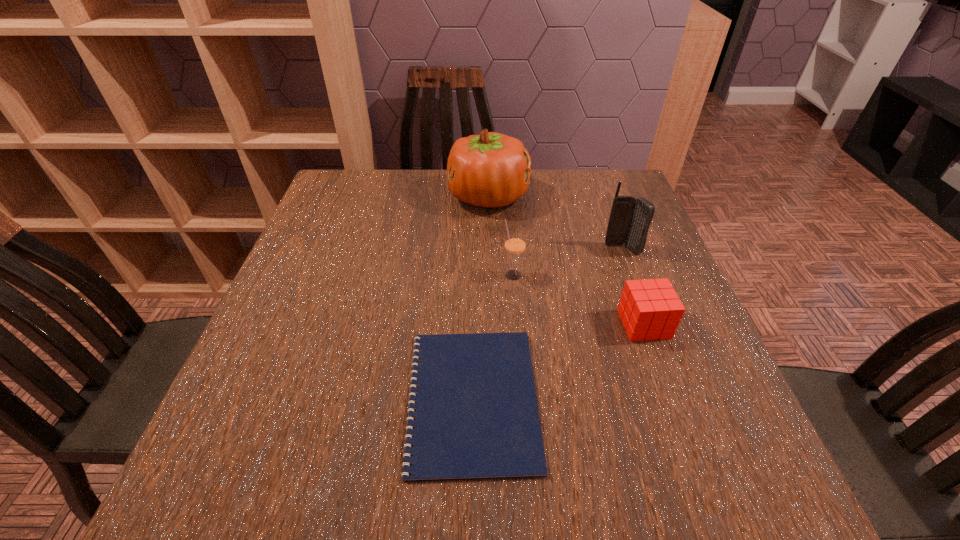
The height and width of the screenshot is (540, 960). Find the location of `vacant area that lies between the notepad and the fourth nearest object`. vacant area that lies between the notepad and the fourth nearest object is located at coordinates (547, 324).

The width and height of the screenshot is (960, 540). Find the location of `vacant area between the third farthest object and the pumpkin`. vacant area between the third farthest object and the pumpkin is located at coordinates (501, 236).

Locate which object is the fourth closest to the cellular telephone. Please provide its 2D coordinates. Your answer should be formatted as a tuple, i.e. [(x, y)], where the tuple contains the x and y coordinates of a point satisfying the conditions above.

[(476, 417)]

Locate an element on the screen. Image resolution: width=960 pixels, height=540 pixels. object that stands as the closest to the fourth nearest object is located at coordinates (650, 309).

I want to click on vacant region that satisfies the following two spatial constraints: 1. on the front side of the third farthest object; 2. on the left side of the second shortest object, so click(x=517, y=324).

I want to click on free space that satisfies the following two spatial constraints: 1. on the side of the cube with the cute face; 2. on the left side of the farthest object, so click(492, 324).

The height and width of the screenshot is (540, 960). What are the coordinates of `free space that satisfies the following two spatial constraints: 1. on the side of the third shortest object with the cute face; 2. on the left side of the farthest object` in the screenshot? It's located at (491, 275).

Where is `vacant space that satisfies the following two spatial constraints: 1. on the side of the pumpkin with the cute face; 2. on the back side of the cube`? vacant space that satisfies the following two spatial constraints: 1. on the side of the pumpkin with the cute face; 2. on the back side of the cube is located at coordinates (492, 324).